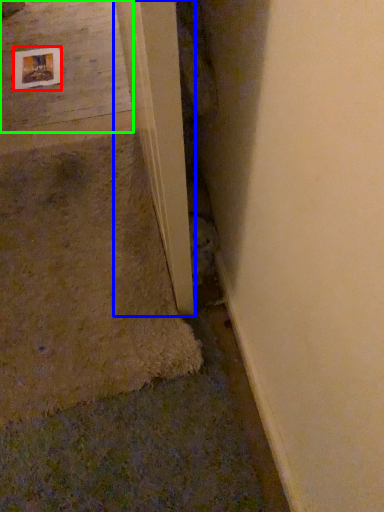
Question: Which object is the farthest from picture frame (highlighted by a red box)? Choose among these: beam (highlighted by a blue box) or concrete (highlighted by a green box).

Choices:
 (A) beam
 (B) concrete

Answer: (A)